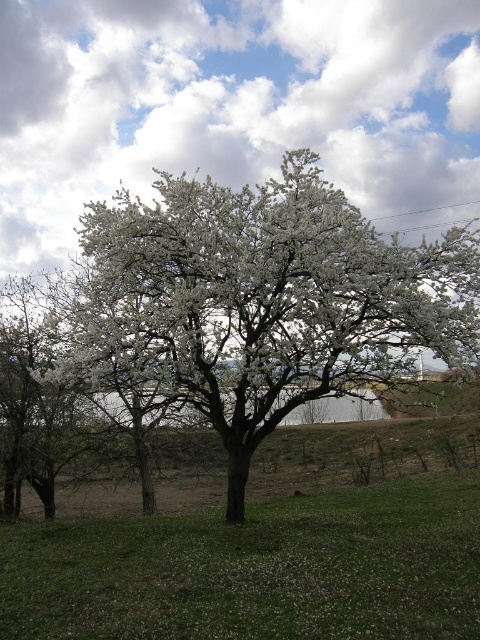
Question: Which of the following is the closest to the observer?

Choices:
 (A) (277, 284)
 (B) (387, 561)

Answer: (B)

Question: Is white blossoming tree at center positioned before green grassy at lower left?

Choices:
 (A) yes
 (B) no

Answer: (B)

Question: Observing the image, what is the correct spatial positioning of white blossoming tree at center in reference to green grassy at lower left?

Choices:
 (A) right
 (B) left

Answer: (A)

Question: Which object appears farthest from the camera in this image?

Choices:
 (A) white blossoming tree at center
 (B) green grassy at lower left

Answer: (A)

Question: Can you confirm if white blossoming tree at center is positioned below green grassy at lower left?

Choices:
 (A) no
 (B) yes

Answer: (A)